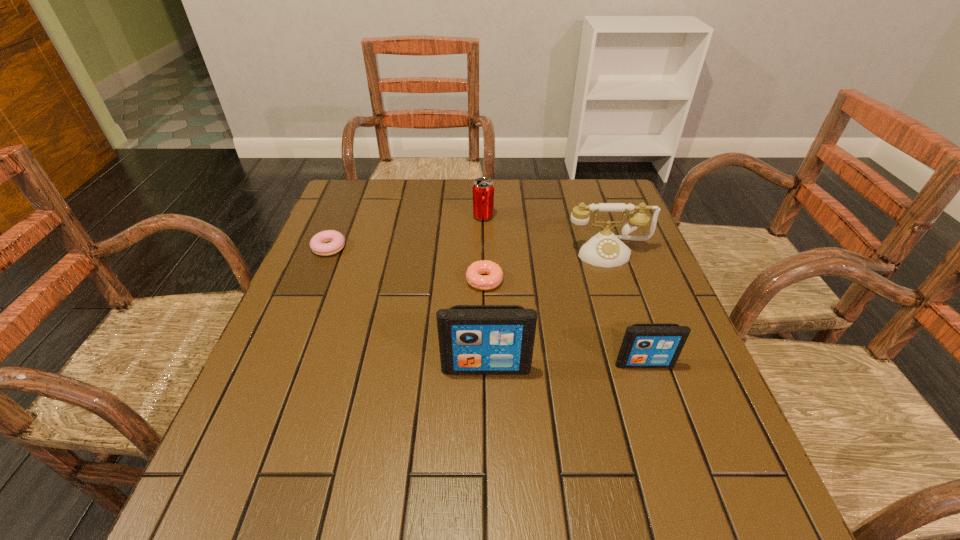
Locate an element on the screen. This screenshot has height=540, width=960. the taller iPod is located at coordinates (473, 339).

Locate an element on the screen. the right iPod is located at coordinates (644, 345).

Locate an element on the screen. The height and width of the screenshot is (540, 960). soda can is located at coordinates (483, 188).

The height and width of the screenshot is (540, 960). What are the coordinates of `telephone` in the screenshot? It's located at (604, 249).

The image size is (960, 540). I want to click on the fourth farthest object, so click(473, 274).

The image size is (960, 540). What are the coordinates of `the right doughnut` in the screenshot? It's located at (473, 274).

Image resolution: width=960 pixels, height=540 pixels. Find the location of `the left doughnut`. the left doughnut is located at coordinates (337, 241).

Image resolution: width=960 pixels, height=540 pixels. I want to click on the farther doughnut, so point(337,241).

I want to click on blank space located on the front screen of the left iPod, so click(487, 416).

At what (x,y) coordinates should I click in order to perform the action: click on free space located 0.120m on the front screen of the right iPod. Please return your answer as a coordinate pair (x, y). Looking at the image, I should click on (664, 423).